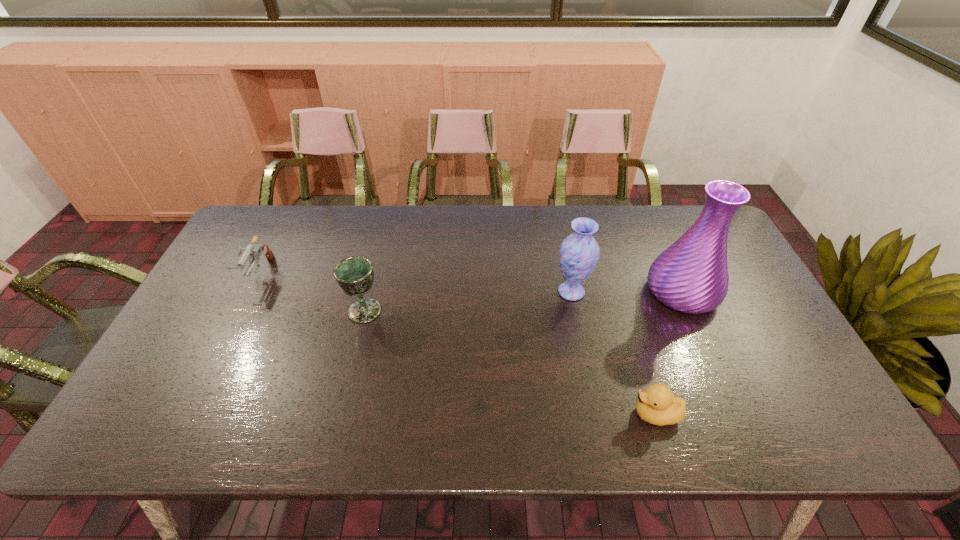
The image size is (960, 540). I want to click on the tallest object, so click(x=691, y=276).

The height and width of the screenshot is (540, 960). In order to click on the right vase in this screenshot , I will do `click(691, 276)`.

At what (x,y) coordinates should I click in order to perform the action: click on the third object from right to left. Please return your answer as a coordinate pair (x, y). The image size is (960, 540). Looking at the image, I should click on (579, 252).

At what (x,y) coordinates should I click in order to perform the action: click on the fourth shortest object. Please return your answer as a coordinate pair (x, y). The width and height of the screenshot is (960, 540). Looking at the image, I should click on (579, 252).

The height and width of the screenshot is (540, 960). In order to click on the third tallest object in this screenshot , I will do `click(354, 275)`.

The height and width of the screenshot is (540, 960). In order to click on the fourth object from right to left in this screenshot , I will do point(354,275).

Find the location of a particular element. Image resolution: width=960 pixels, height=540 pixels. gun is located at coordinates (251, 251).

The width and height of the screenshot is (960, 540). In order to click on the fourth object from left to right in this screenshot , I will do `click(656, 405)`.

The width and height of the screenshot is (960, 540). Identify the location of the nearest object. tap(656, 405).

Identify the location of vacant region located 0.240m on the left of the taller vase. The width and height of the screenshot is (960, 540). (564, 292).